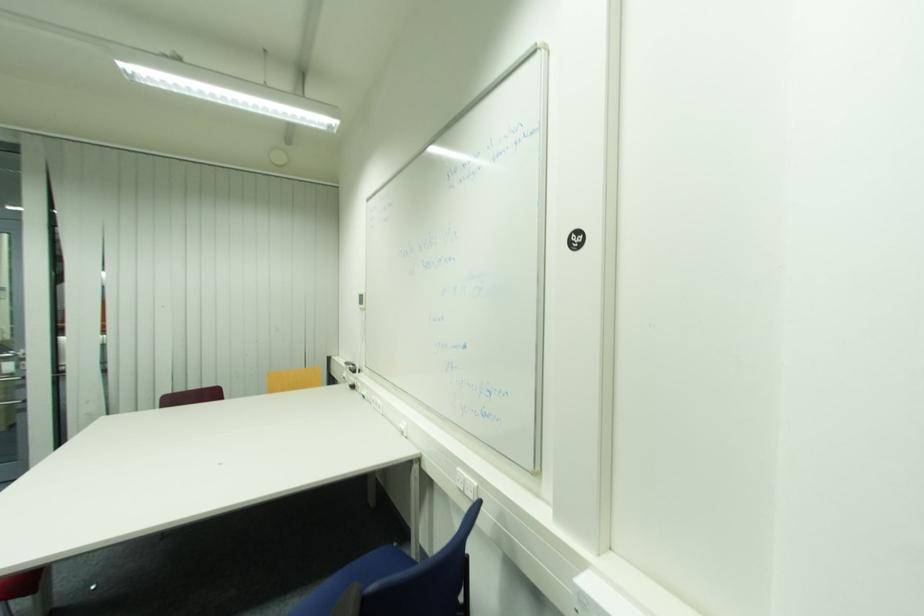
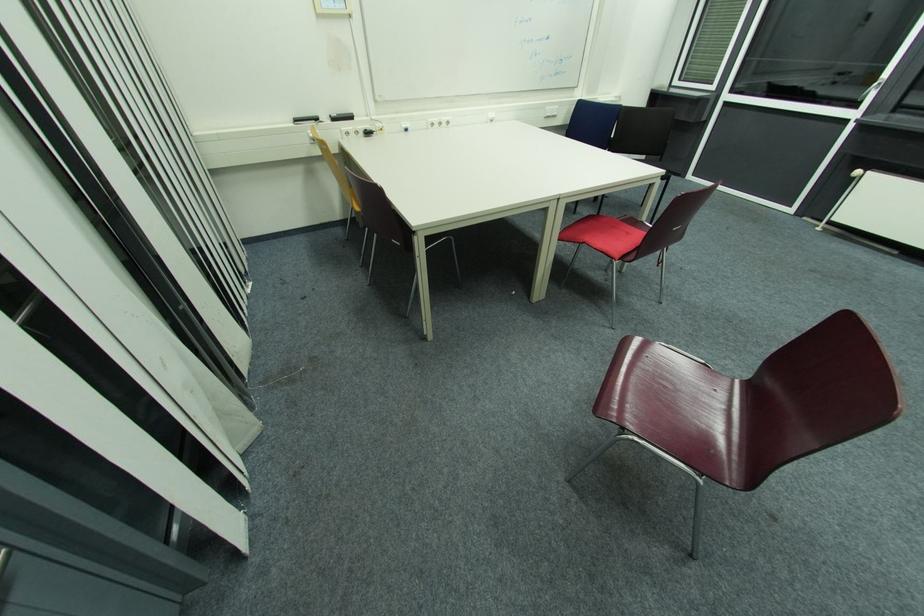
Where in the second image is the point corresponding to (x=354, y=371) from the first image?

(337, 121)